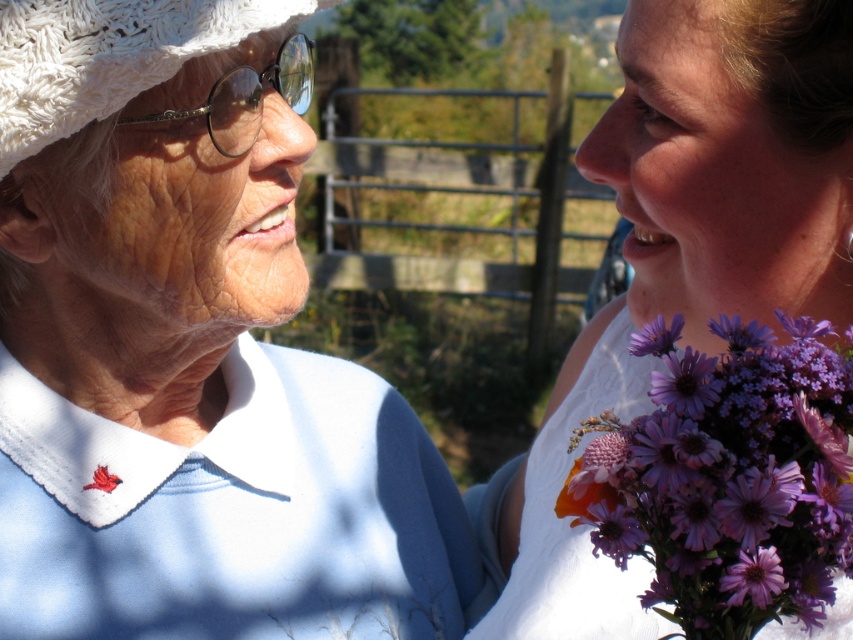
In the scene shown: You are a photographer trying to capture a portrait of the two people in the scene. You want to ensure that both the white cotton blouse at left and the purple matte flower at center are clearly visible in the frame. Based on their positions, which object is closer to the left edge of the photo?

The white cotton blouse at left is closer to the left edge of the photo because it is positioned on the left side of the purple matte flower at center.

You are standing in front of a painting that depicts the scene described. The painting is displayed on a wall, and you want to touch the white textured hat at upper left without moving your hand from its current position. Is your hand close enough to reach it?

The white textured hat at upper left is 1.02 meters from viewer, so if your hand is at your side, it may not reach the hat which is 1.02 meters away. You might need to stretch or move closer.